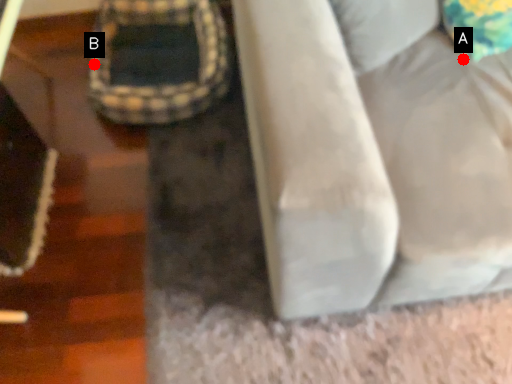
Question: Two points are circled on the image, labeled by A and B beside each circle. Which point is further to the camera?

Choices:
 (A) A is further
 (B) B is further

Answer: (B)